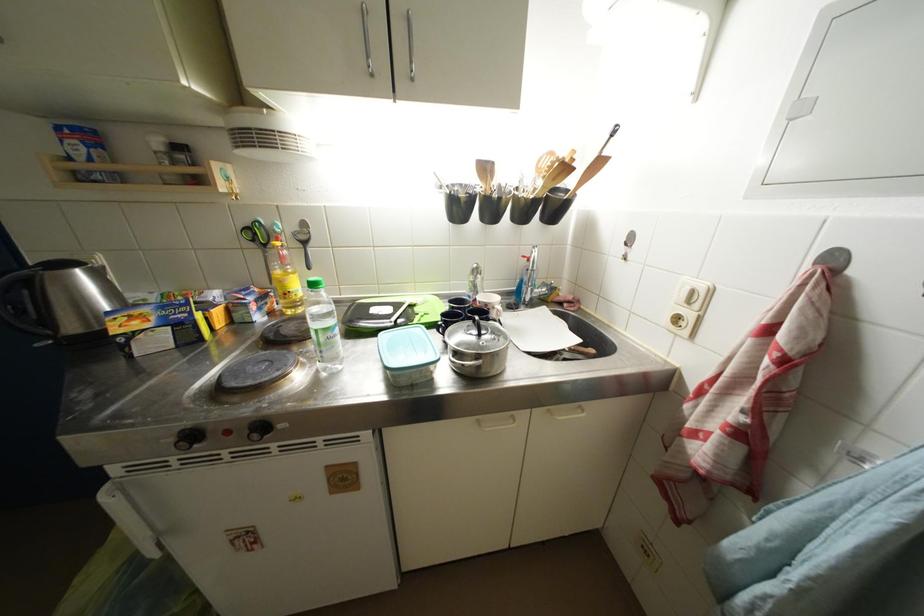
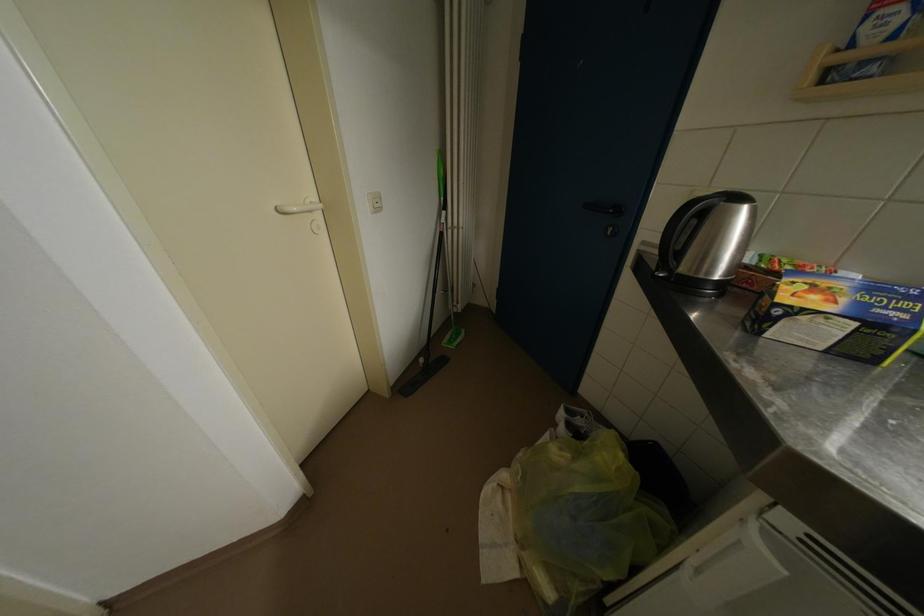
Where in the second image is the point corresponding to the point at 122,334 from the first image?

(791, 302)